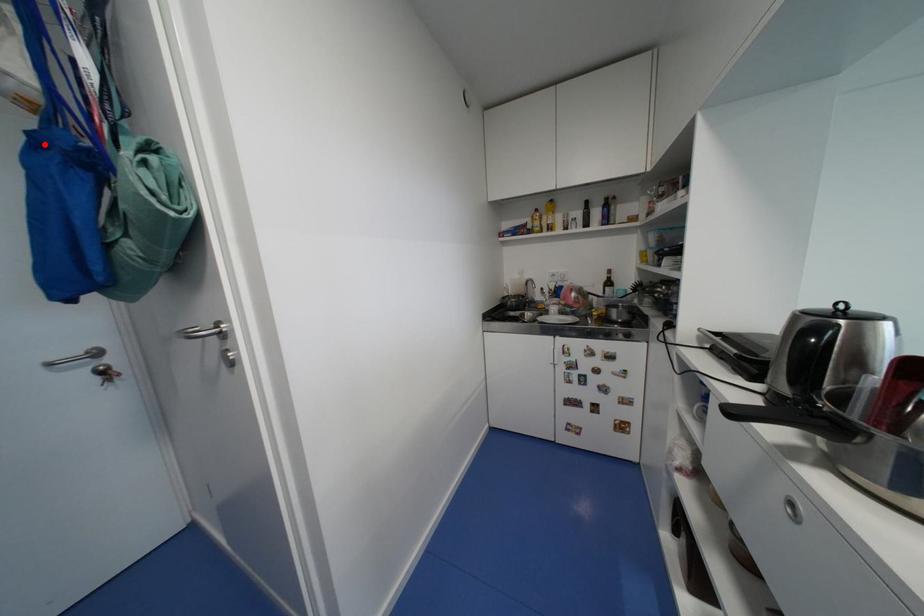
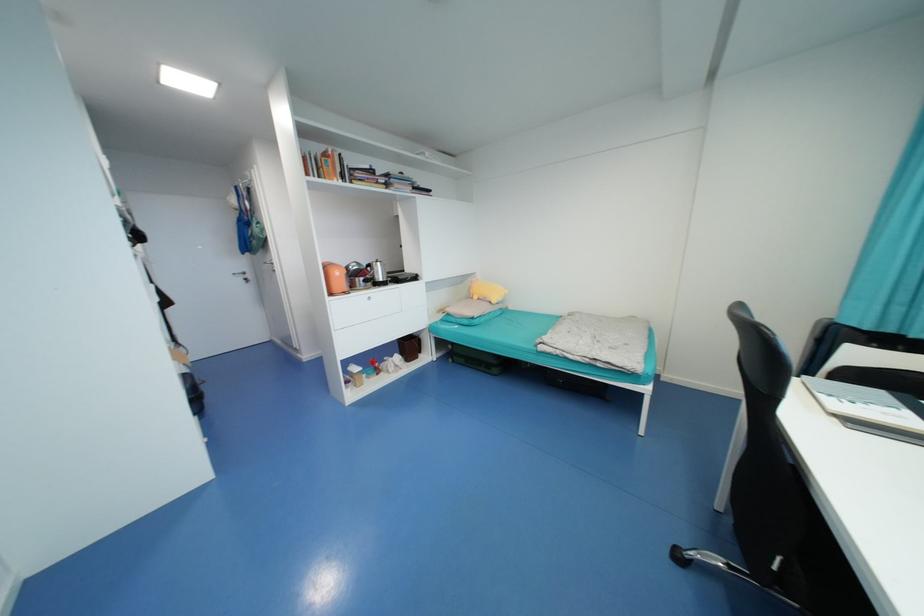
The point at the highlighted location is marked in the first image. Where is the corresponding point in the second image?

(244, 221)